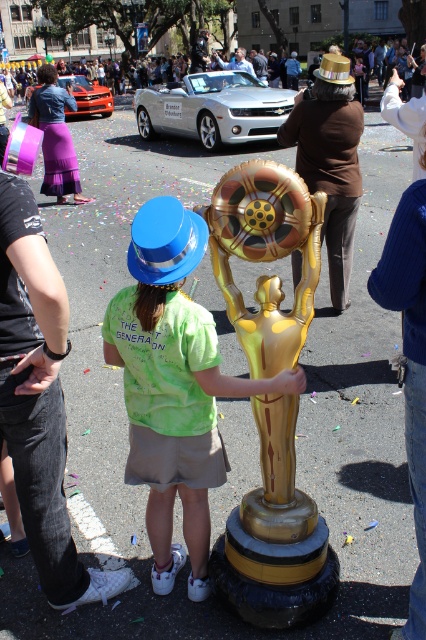
Looking at this image, is the position of gold metallic statue at center less distant than that of green tie-dye shirt at center?

No, it is not.

Between point (256, 232) and point (155, 544), which one is positioned in front?

Point (256, 232)

At what (x,y) coordinates should I click in order to perform the action: click on gold metallic statue at center. Please return your answer as a coordinate pair (x, y). Looking at the image, I should click on (276, 534).